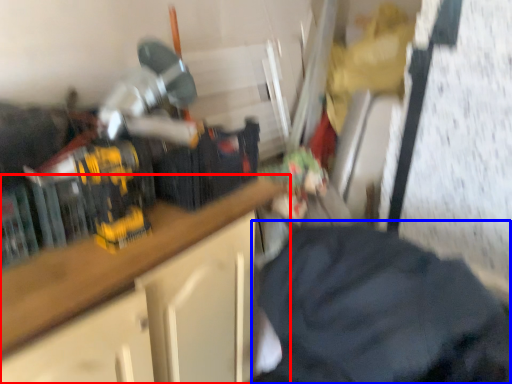
Question: Which object appears farthest to the camera in this image, cabinetry (highlighted by a red box) or clothing (highlighted by a blue box)?

Choices:
 (A) cabinetry
 (B) clothing

Answer: (A)